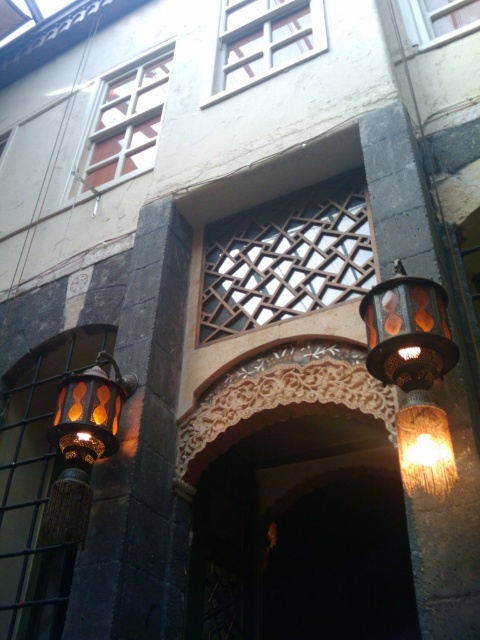
You are standing in front of the building and want to locate the carved stone archway at center. According to the coordinates provided, where exactly is it positioned?

The carved stone archway at center is located at point 0.834 on the x axis and 0.627 on the y axis.